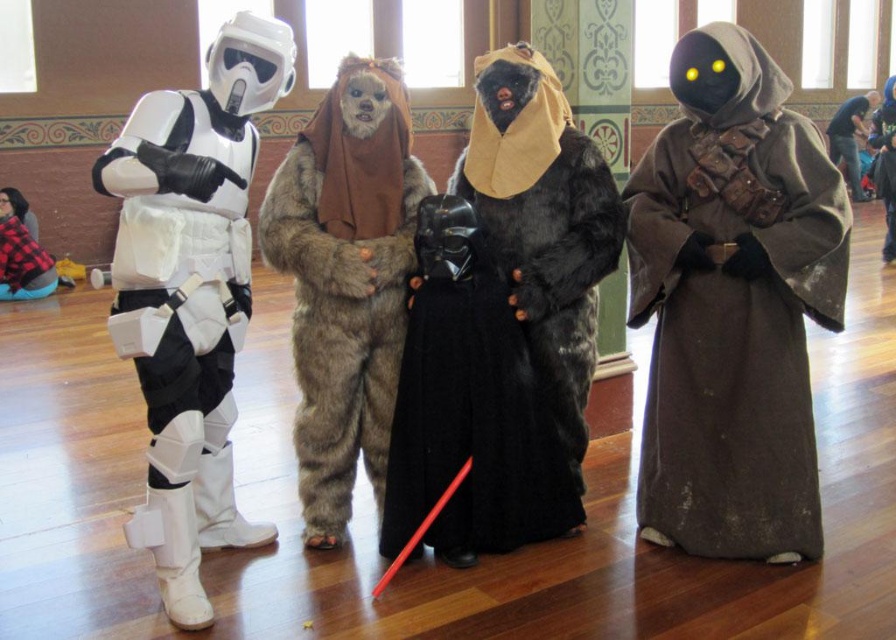
Who is lower down, fuzzy black cape at center or dark brown fabric bag at upper right?

fuzzy black cape at center

Which is more to the left, fuzzy black cape at center or dark brown fabric bag at upper right?

From the viewer's perspective, fuzzy black cape at center appears more on the left side.

What do you see at coordinates (503, 324) in the screenshot? The width and height of the screenshot is (896, 640). I see `fuzzy black cape at center` at bounding box center [503, 324].

Where is `fuzzy black cape at center`? fuzzy black cape at center is located at coordinates (503, 324).

Who is lower down, furry costume at center or dark brown fabric bag at upper right?

furry costume at center is lower down.

Is furry costume at center to the right of dark brown fabric bag at upper right from the viewer's perspective?

No, furry costume at center is not to the right of dark brown fabric bag at upper right.

I want to click on furry costume at center, so click(345, 282).

Between brown suede robe at right and dark brown fabric bag at upper right, which one is positioned higher?

dark brown fabric bag at upper right is above.

Find the location of a particular element. The width and height of the screenshot is (896, 640). brown suede robe at right is located at coordinates (731, 305).